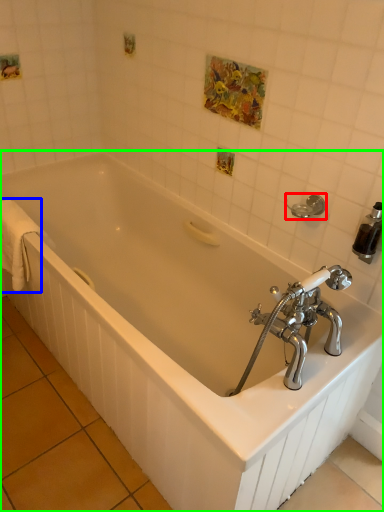
Question: Which is farther away from towel bar (highlighted by a red box)? bath towel (highlighted by a blue box) or bathtub (highlighted by a green box)?

Choices:
 (A) bath towel
 (B) bathtub

Answer: (A)